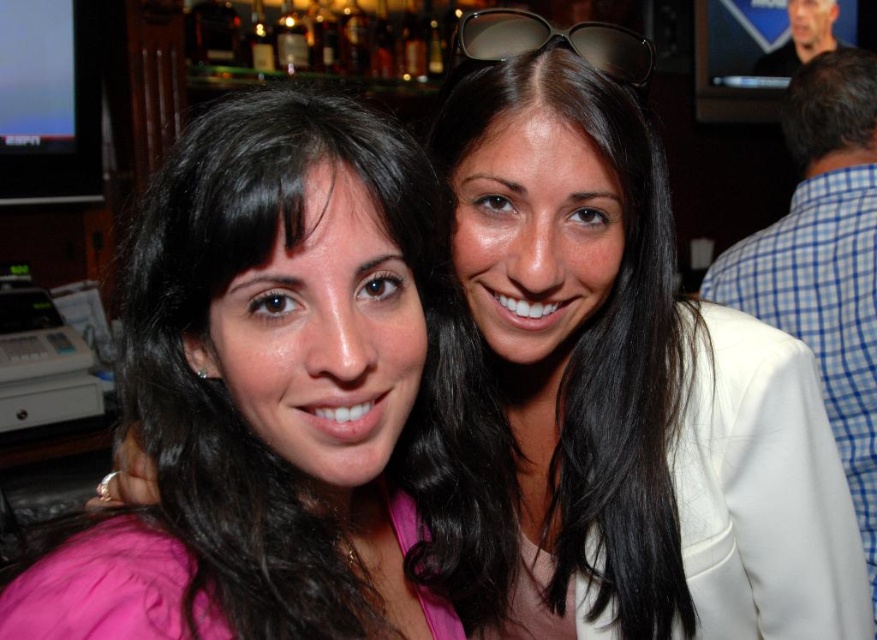
You are a photographer trying to capture a clear shot of the two objects mentioned. Since the white fabric jacket at right and the brown reflective sunglasses at upper center are both in the frame, which object would you focus on first to ensure it fills the frame properly?

The white fabric jacket at right is bigger than the brown reflective sunglasses at upper center, so focusing on the white fabric jacket at right first would ensure it fills the frame properly.

Consider the image. You are a photographer trying to adjust the lighting for a portrait. You notice the brown reflective sunglasses at upper center and the white fabric jacket at right. Which object is closer to the camera?

The white fabric jacket at right is closer to the camera than the brown reflective sunglasses at upper center because the sunglasses are positioned behind the jacket.